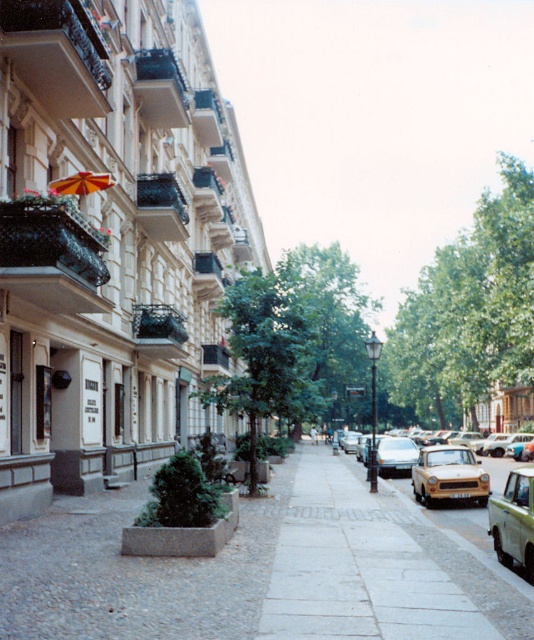
In the scene shown: Between green matte car at right and matte yellow car at center-right, which one has less height?

With less height is matte yellow car at center-right.

Is green matte car at right bigger than matte yellow car at center-right?

Actually, green matte car at right might be smaller than matte yellow car at center-right.

Does point (531, 490) come behind point (389, 454)?

No.

I want to click on green matte car at right, so pyautogui.click(x=514, y=522).

This screenshot has height=640, width=534. Identify the location of beige matte taxi at lower right. (449, 476).

In the scene shown: Can you confirm if beige matte taxi at lower right is positioned to the left of matte yellow car at center-right?

Indeed, beige matte taxi at lower right is positioned on the left side of matte yellow car at center-right.

Between point (451, 460) and point (406, 458), which one is positioned in front?

Point (451, 460)

What are the coordinates of `beige matte taxi at lower right` in the screenshot? It's located at click(x=449, y=476).

Does point (435, 481) come closer to viewer compared to point (72, 188)?

No, (435, 481) is further to viewer.

Which is more to the left, beige matte taxi at lower right or orange fabric umbrella at upper left?

From the viewer's perspective, orange fabric umbrella at upper left appears more on the left side.

Identify the location of beige matte taxi at lower right. Image resolution: width=534 pixels, height=640 pixels. (449, 476).

The image size is (534, 640). I want to click on beige matte taxi at lower right, so click(449, 476).